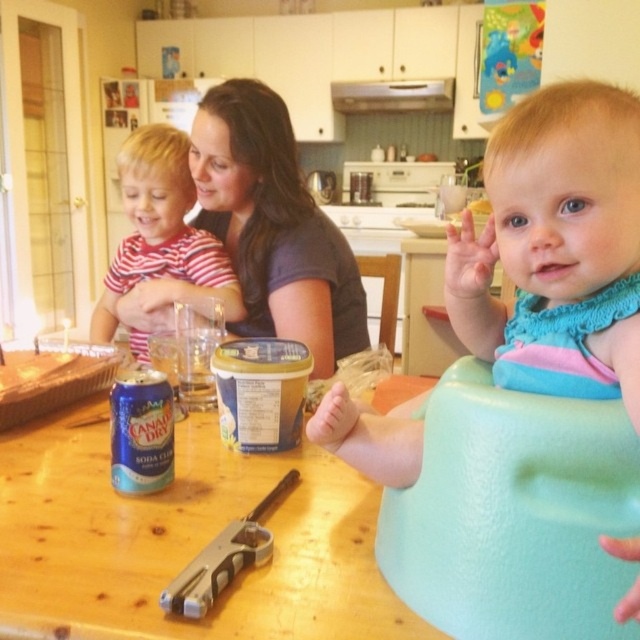
You are standing at point [193,570] and want to walk to point [148,260]. According to the image, will you be moving forward or backward?

Since point [148,260] is behind point [193,570], moving from [193,570] to [148,260] would require moving backward.

You are a parent in the kitchen and want to place the blue fabric bib at center and the silver metallic toy gun at center on a shelf that is 12 inches wide. Will both items fit side by side on the shelf?

The distance between the blue fabric bib at center and the silver metallic toy gun at center is 11.74 inches, so they can fit side by side on the 12 inch wide shelf since the total space needed is less than the shelf width.

Please describe the position of the blue fabric bib at center in the image using coordinates. The answer should be in the format of coordinates like 0.388, 0.870.

The blue fabric bib at center is located at coordinates (556, 248).